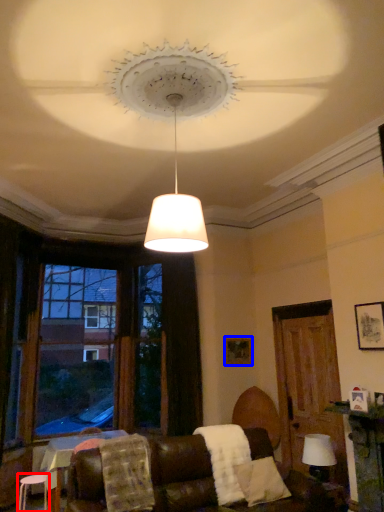
Question: Which object is closer to the camera taking this photo, stool (highlighted by a red box) or picture frame (highlighted by a blue box)?

Choices:
 (A) stool
 (B) picture frame

Answer: (A)